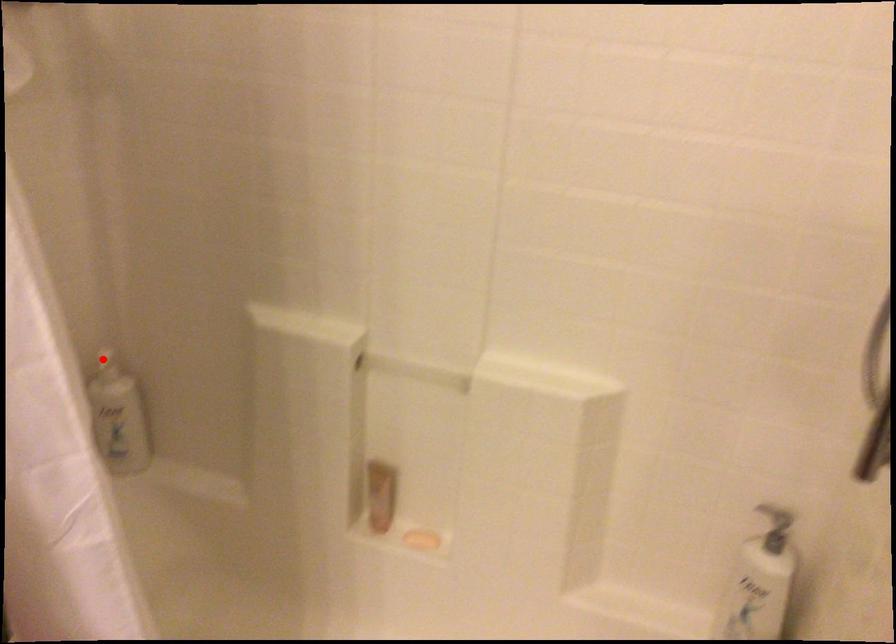
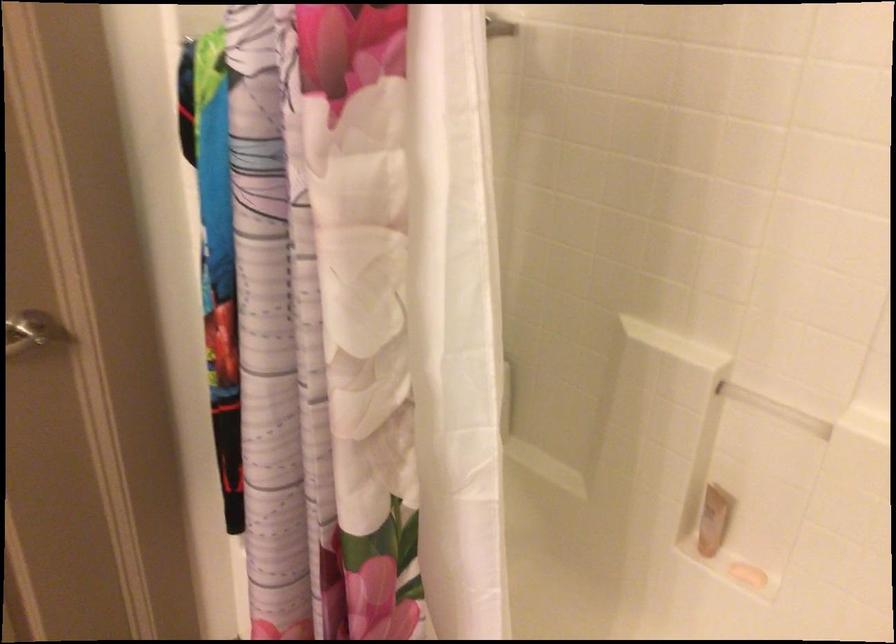
Question: I am providing you with two images of the same scene from different viewpoints. A red point is marked on the first image. Can you still see the location of the red point in image 2?

Choices:
 (A) Yes
 (B) No

Answer: (B)